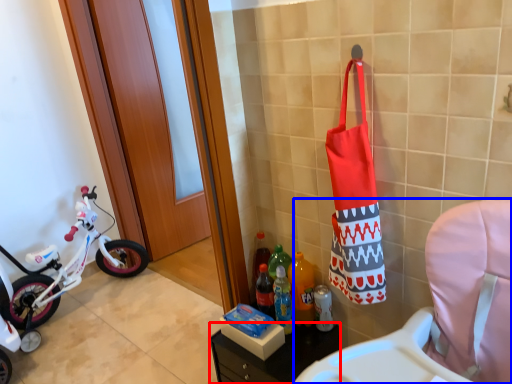
Question: Which object appears farthest to the camera in this image, furniture (highlighted by a red box) or rocking chair (highlighted by a blue box)?

Choices:
 (A) furniture
 (B) rocking chair

Answer: (A)